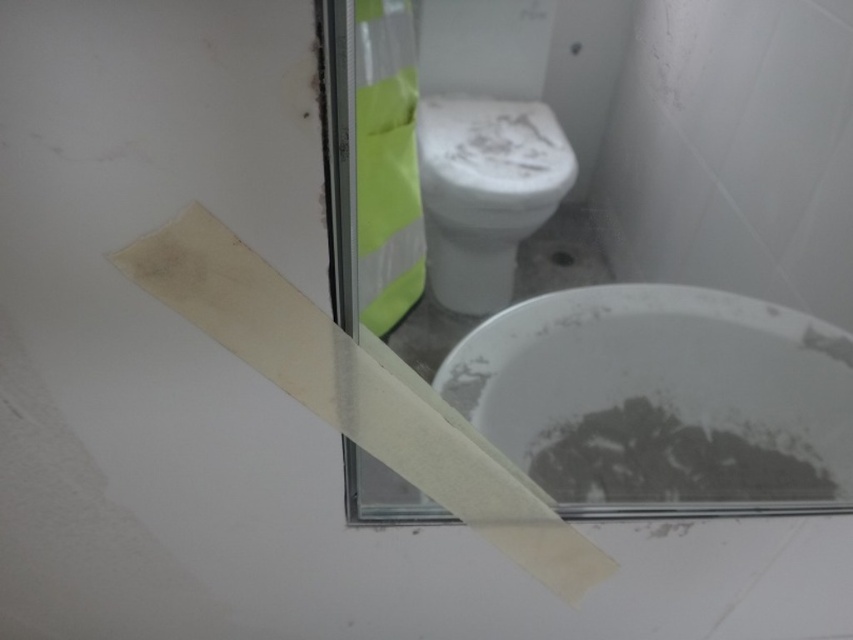
Is white matte toilet paper at center to the right of gray matte debris at lower center from the viewer's perspective?

No, white matte toilet paper at center is not to the right of gray matte debris at lower center.

Is point (184, 241) closer to camera compared to point (631, 442)?

Yes, it is.

You are a GUI agent. You are given a task and a screenshot of the screen. Output one action in this format:
    pyautogui.click(x=<x>, y=<y>)
    Task: Click on the white matte toilet paper at center
    The height and width of the screenshot is (640, 853).
    Given the screenshot: What is the action you would take?
    pyautogui.click(x=358, y=392)

How far apart are gray matte debris at lower center and yellow reflective tape at upper center?

gray matte debris at lower center and yellow reflective tape at upper center are 14.53 inches apart from each other.

Who is lower down, gray matte debris at lower center or yellow reflective tape at upper center?

gray matte debris at lower center is below.

At what (x,y) coordinates should I click in order to perform the action: click on gray matte debris at lower center. Please return your answer as a coordinate pair (x, y). Looking at the image, I should click on (674, 460).

Can you confirm if white matte toilet paper at center is positioned to the left of white glossy toilet bowl at center?

Yes, white matte toilet paper at center is to the left of white glossy toilet bowl at center.

Is white matte toilet paper at center in front of white glossy toilet bowl at center?

That is True.

Find the location of `white matte toilet paper at center`. white matte toilet paper at center is located at coordinates (358, 392).